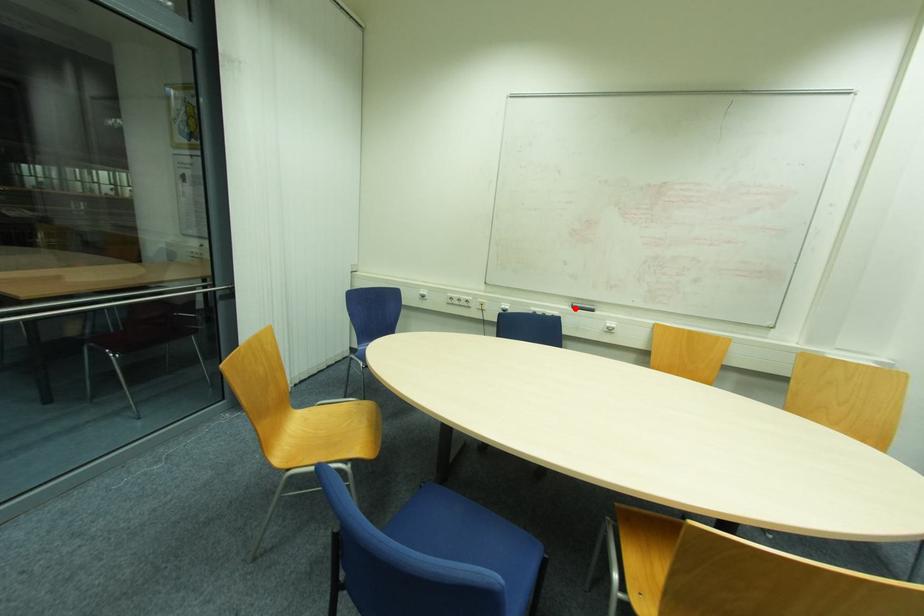
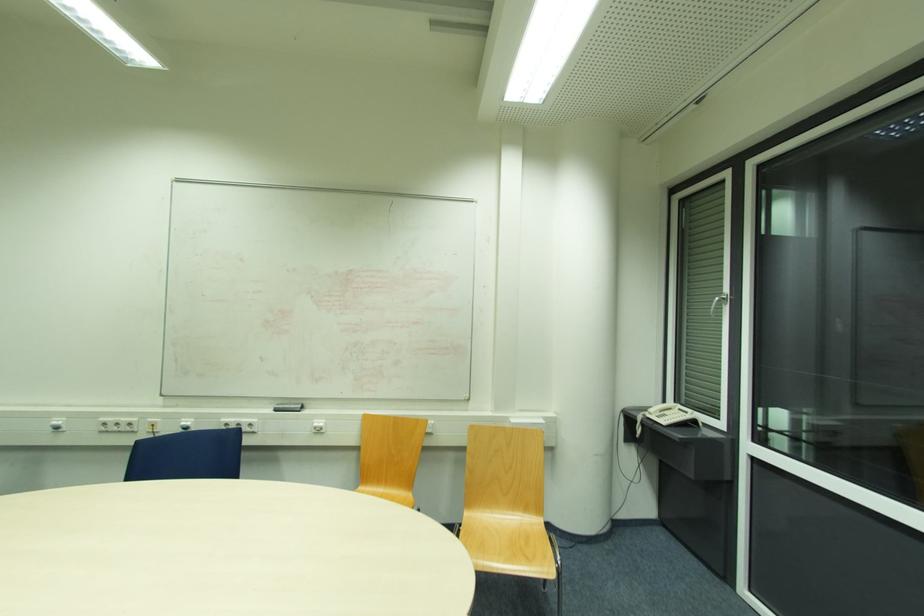
Question: I am providing you with two images of the same scene from different viewpoints. Image1 has a red point marked. In image2, the corresponding 3D location appears at what relative position? Reply with the corresponding letter.

Choices:
 (A) Closer
 (B) Farther

Answer: (B)